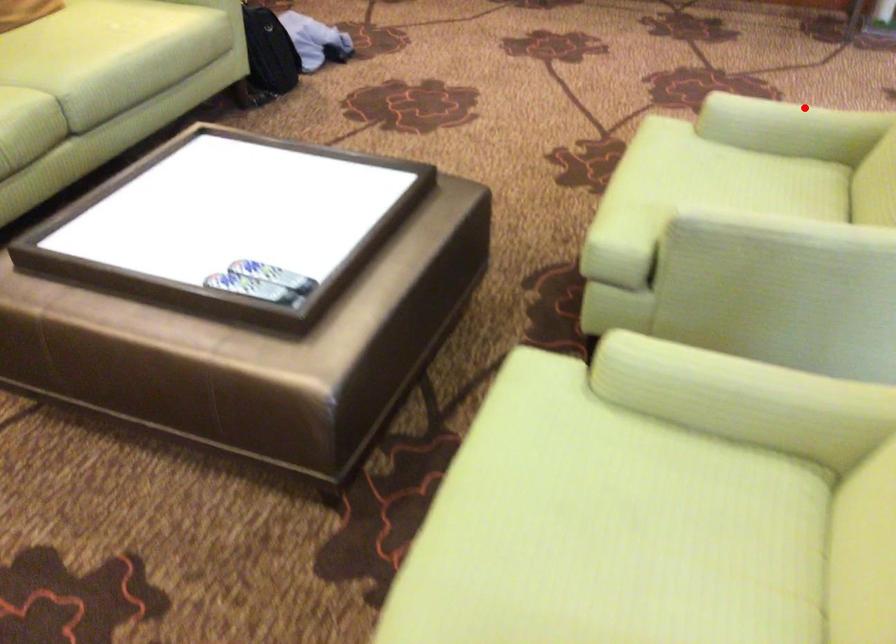
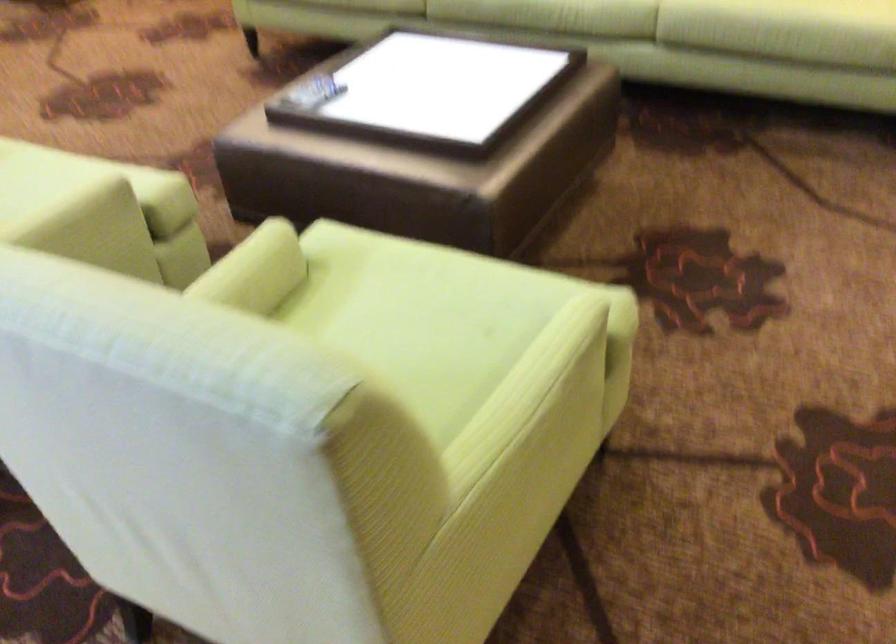
Question: A red point is marked in image1. In image2, is the corresponding 3D point closer to the camera or farther? Reply with the corresponding letter.

Choices:
 (A) The corresponding 3D point is closer.
 (B) The corresponding 3D point is farther.

Answer: (A)